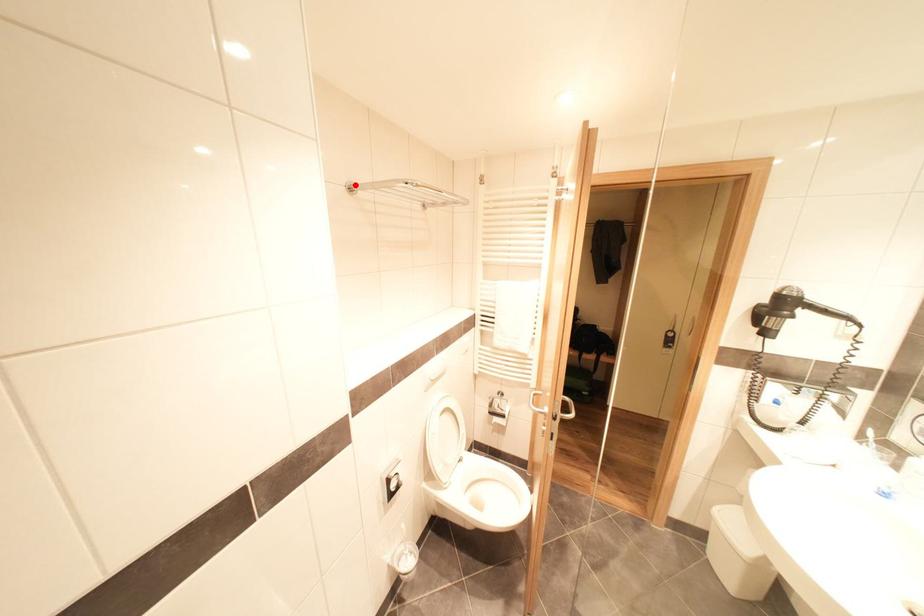
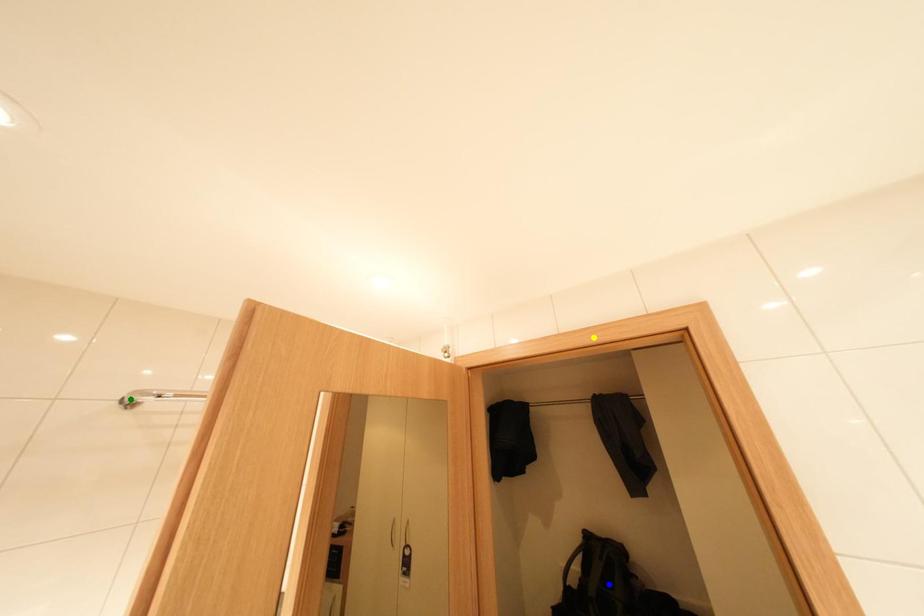
Question: I am providing you with two images of the same scene from different viewpoints. A red point is marked on the first image. You are given multiple points on the second image. In image 2, which mark is for the same physical point as the one in image 1?

Choices:
 (A) blue point
 (B) green point
 (C) yellow point

Answer: (B)